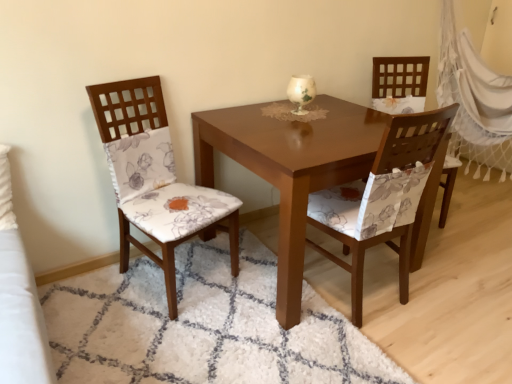
You are a GUI agent. You are given a task and a screenshot of the screen. Output one action in this format:
    pyautogui.click(x=<x>, y=<y>)
    Task: Click on the free space to the right of floral fabric chair at right, which is the 1th chair from right to left
    The height and width of the screenshot is (384, 512).
    Given the screenshot: What is the action you would take?
    pyautogui.click(x=476, y=224)